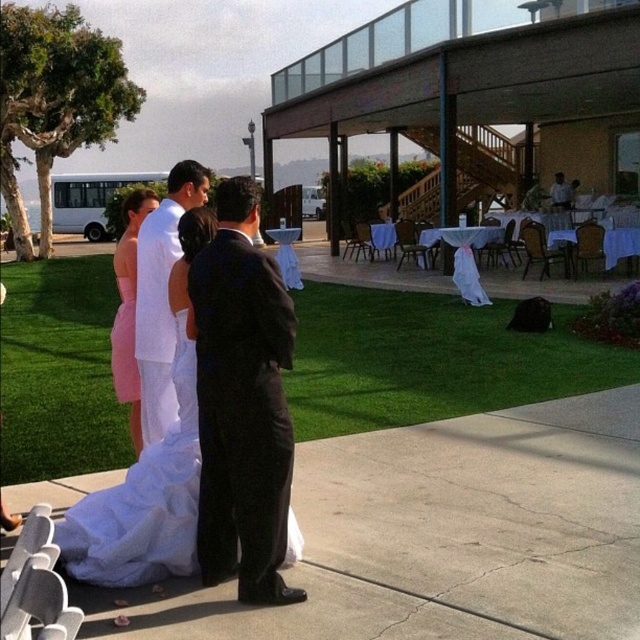
Consider the image. You are a photographer at the wedding and need to capture a closeup shot of both the white satin dress at center and the pink satin dress at center. Since you can only focus on one dress at a time, which dress should you choose to ensure the other dress is still partially visible in the frame?

The white satin dress at center occupies less space than the pink satin dress at center. Therefore, focusing on the pink satin dress at center would allow the smaller white satin dress at center to still be partially visible in the frame.

You are a photographer at the wedding and need to capture a closeup shot of both the white satin dress at center and the white matte suit at center. Given that your camera frame can only accommodate one of the two objects at a time, which one should you focus on first to ensure it fits within the frame?

The white satin dress at center has a larger width than the white matte suit at center, so you should focus on capturing the white satin dress at center first to ensure it fits within the camera frame.